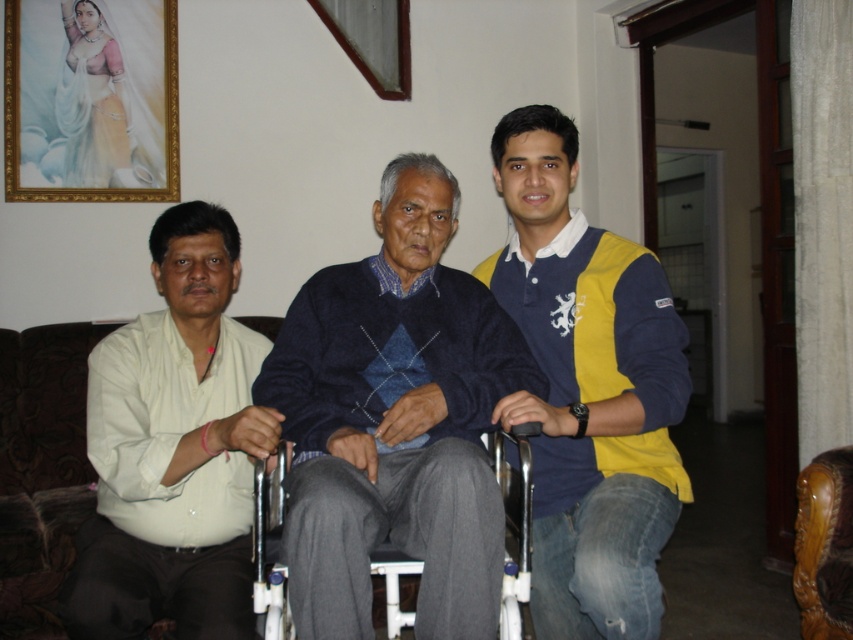
Based on the photo, you are a photographer setting up a shoot in this living room. You have a camera that can only focus on objects within 2 meters. You want to take a photo of both the dark blue sweater at center and the brown leather chair at lower right. Can you ensure both are in focus without moving the camera?

The dark blue sweater at center is closer to the viewer than the brown leather chair at lower right. Since the camera can focus within 2 meters, both objects must be within that range. However, the distance between them isn

You are planning to buy a new chair for the living room. The current chair is the brown leather chair at lower right. You want to replace it with a chair that is the same size as the dark blue sweater at center. Is this possible?

The dark blue sweater at center is bigger than the brown leather chair at lower right. Therefore, replacing the brown leather chair at lower right with a chair the same size as the dark blue sweater at center would require a larger chair, which may not be feasible if space is limited.